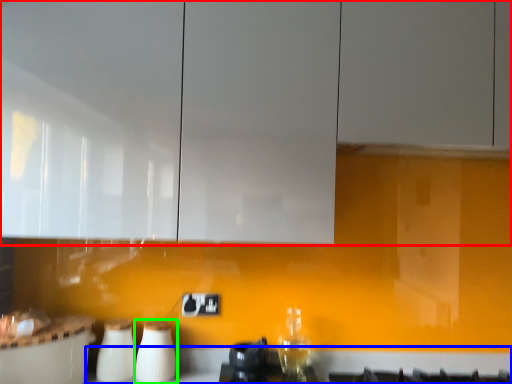
Question: Estimate the real-world distances between objects in this image. Which object is closer to cabinetry (highlighted by a red box), counter top (highlighted by a blue box) or appliance (highlighted by a green box)?

Choices:
 (A) counter top
 (B) appliance

Answer: (B)